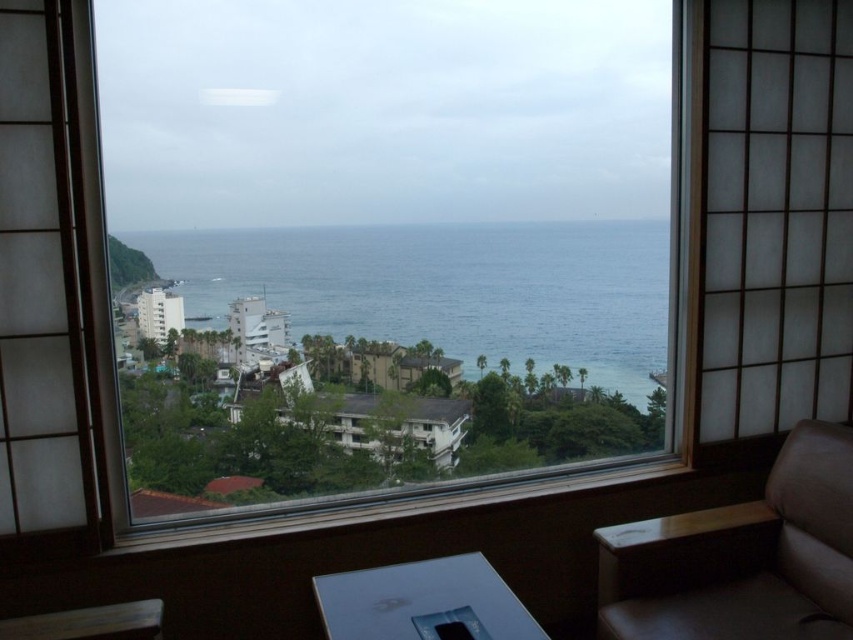
You are sitting on the brown leather couch at lower right and want to look out the window. Which direction should you turn your head to see the blue water at center first?

Since the blue water at center is wider than the brown leather couch at lower right, you should turn your head towards the center of the room to see the blue water at center first.

You are sitting on the brown leather couch at lower right and want to see the view outside the window. Is the wooden frame at center blocking your view of the window?

The wooden frame at center is much taller than the brown leather couch at lower right, so it is blocking your view of the window.